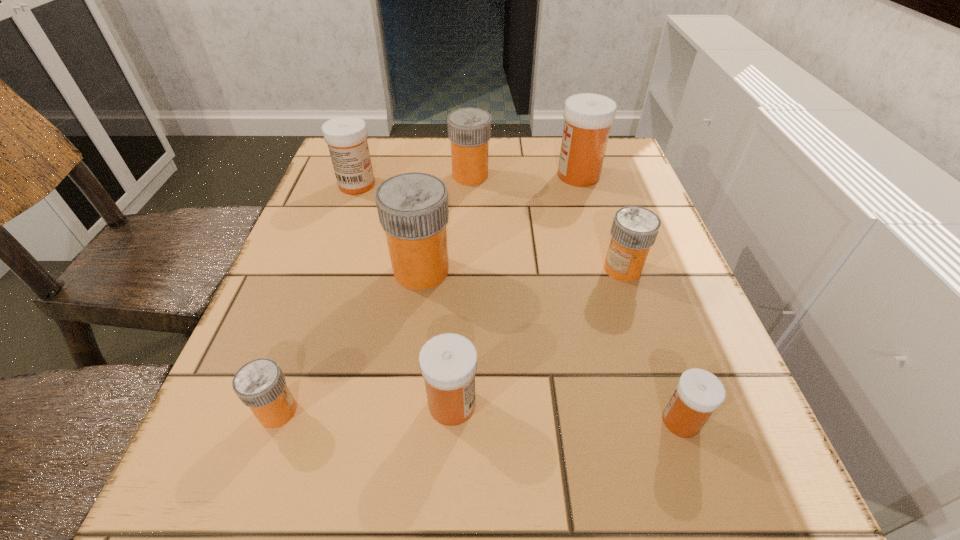
Identify the location of vacant space situated on the label side of the biggest orange medicine. [572, 271].

This screenshot has width=960, height=540. I want to click on vacant region located 0.260m on the front of the leftmost white medicine, so click(x=325, y=275).

I want to click on free space located 0.160m on the label side of the second biggest orange medicine, so click(556, 176).

This screenshot has width=960, height=540. In order to click on vacant space located on the label side of the third biggest orange medicine in this screenshot , I will do `click(457, 269)`.

This screenshot has height=540, width=960. Identify the location of vacant space located on the label side of the third biggest orange medicine. point(395,269).

Find the location of `free space located on the label side of the third biggest orange medicine`. free space located on the label side of the third biggest orange medicine is located at coordinates (415, 269).

Locate an element on the screen. The height and width of the screenshot is (540, 960). blank space located on the right of the third white medicine from right to left is located at coordinates (675, 404).

You are a GUI agent. You are given a task and a screenshot of the screen. Output one action in this format:
    pyautogui.click(x=<x>, y=<y>)
    Task: Click on the blank space located 0.340m on the left of the smallest white medicine
    This screenshot has height=540, width=960.
    Given the screenshot: What is the action you would take?
    pyautogui.click(x=422, y=421)

Image resolution: width=960 pixels, height=540 pixels. In order to click on vacant space located 0.390m on the label side of the leftmost orange medicine in this screenshot , I will do `click(567, 411)`.

Where is `object that is at the far left corner`? This screenshot has height=540, width=960. object that is at the far left corner is located at coordinates (346, 136).